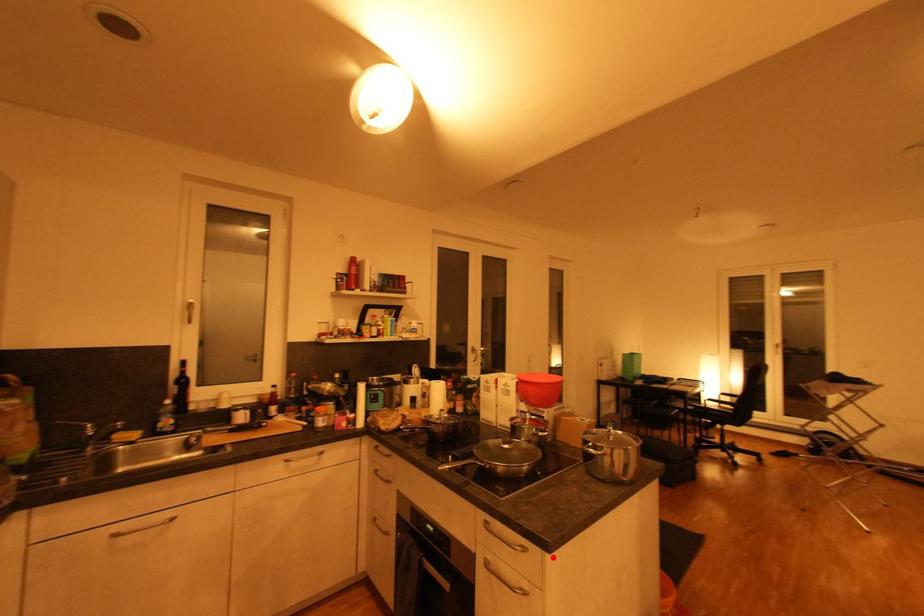
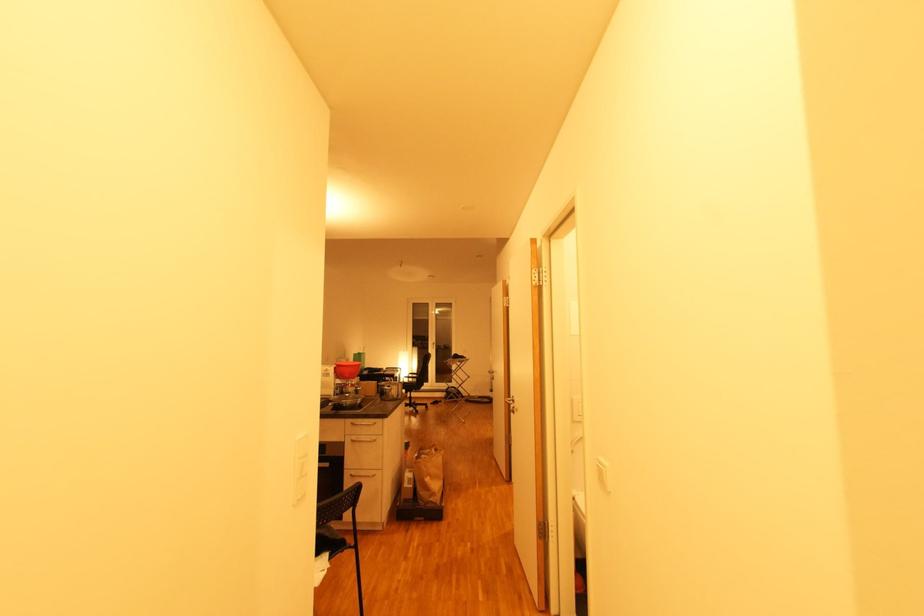
Find the pixel in the second image that matches the highlighted location in the first image.

(391, 421)